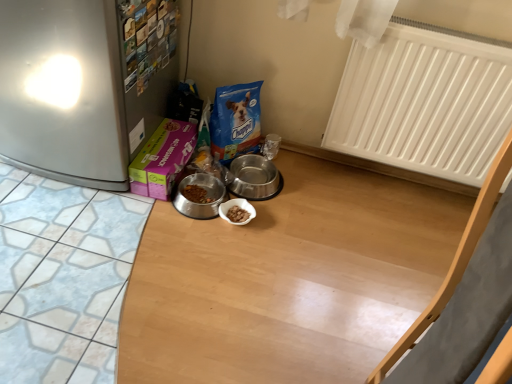
Question: Does metallic stainless steel bowl at center, positioned as the 2th appliance in left-to-right order, appear on the right side of brushed metal fridge at left?

Choices:
 (A) no
 (B) yes

Answer: (B)

Question: Is metallic stainless steel bowl at center, which appears as the first appliance when viewed from the right, oriented towards brushed metal fridge at left?

Choices:
 (A) yes
 (B) no

Answer: (B)

Question: Does metallic stainless steel bowl at center, which appears as the first appliance when viewed from the right, have a larger size compared to brushed metal fridge at left?

Choices:
 (A) yes
 (B) no

Answer: (B)

Question: Is brushed metal fridge at left at the back of metallic stainless steel bowl at center, positioned as the 2th appliance in left-to-right order?

Choices:
 (A) no
 (B) yes

Answer: (B)

Question: Is metallic stainless steel bowl at center, positioned as the 2th appliance in left-to-right order, far away from brushed metal fridge at left?

Choices:
 (A) yes
 (B) no

Answer: (B)

Question: Which is correct: metallic silver bowl at center, which is the 2th appliance from right to left, is inside brushed metal fridge at left, or outside of it?

Choices:
 (A) inside
 (B) outside

Answer: (B)

Question: Is point (205, 185) closer or farther from the camera than point (114, 21)?

Choices:
 (A) closer
 (B) farther

Answer: (B)

Question: Based on their sizes in the image, would you say metallic silver bowl at center, which is the 2th appliance from right to left, is bigger or smaller than brushed metal fridge at left?

Choices:
 (A) small
 (B) big

Answer: (A)

Question: From a real-world perspective, relative to brushed metal fridge at left, is metallic silver bowl at center, which is the 2th appliance from right to left, vertically above or below?

Choices:
 (A) below
 (B) above

Answer: (A)

Question: From the image's perspective, is brushed metal fridge at left positioned above or below metallic silver bowl at center, which is the 2th appliance from right to left?

Choices:
 (A) above
 (B) below

Answer: (A)

Question: Is brushed metal fridge at left to the left or to the right of metallic silver bowl at center, which is the 2th appliance from right to left, in the image?

Choices:
 (A) left
 (B) right

Answer: (A)

Question: Is brushed metal fridge at left inside or outside of metallic silver bowl at center, the 1th appliance viewed from the left?

Choices:
 (A) outside
 (B) inside

Answer: (A)

Question: From a real-world perspective, is brushed metal fridge at left physically located above or below metallic silver bowl at center, the 1th appliance viewed from the left?

Choices:
 (A) above
 (B) below

Answer: (A)

Question: Is point (250, 177) positioned closer to the camera than point (220, 203)?

Choices:
 (A) closer
 (B) farther

Answer: (B)

Question: From the image's perspective, is metallic stainless steel bowl at center, which appears as the first appliance when viewed from the right, located above or below metallic silver bowl at center, which is the 2th appliance from right to left?

Choices:
 (A) above
 (B) below

Answer: (A)